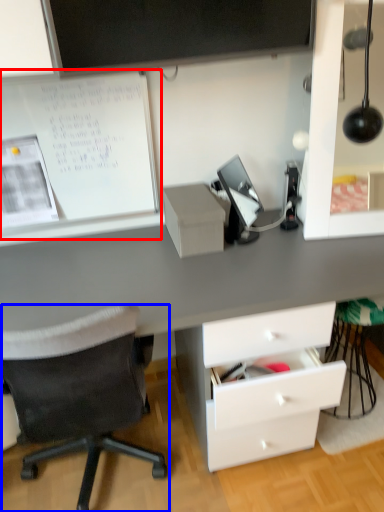
Question: Which of the following is the closest to the observer, bulletin board (highlighted by a red box) or chair (highlighted by a blue box)?

Choices:
 (A) bulletin board
 (B) chair

Answer: (B)